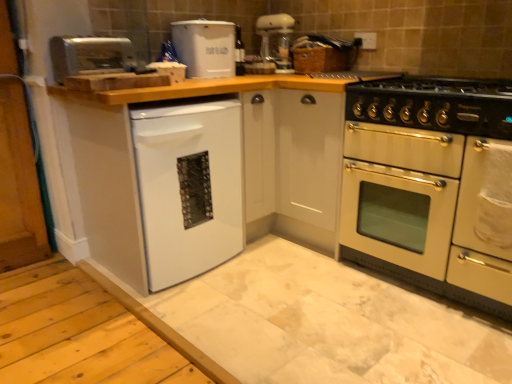
You are a GUI agent. You are given a task and a screenshot of the screen. Output one action in this format:
    pyautogui.click(x=<x>, y=<y>)
    Task: Click on the vacant area located to the right-hand side of white glossy dishwasher at lower left
    The height and width of the screenshot is (384, 512).
    Given the screenshot: What is the action you would take?
    pyautogui.click(x=275, y=280)